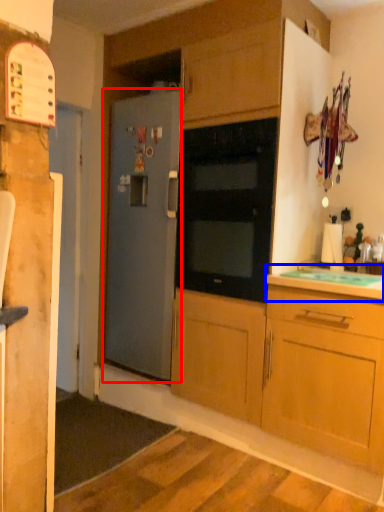
Question: Which object is closer to the camera taking this photo, refrigerator (highlighted by a red box) or countertop (highlighted by a blue box)?

Choices:
 (A) refrigerator
 (B) countertop

Answer: (B)